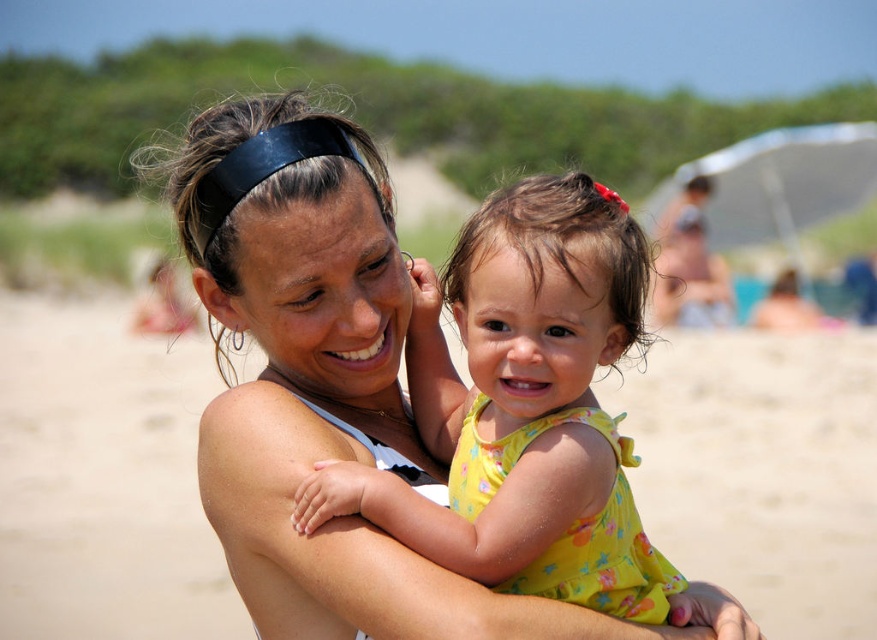
In the scene shown: You are standing at the point labeled point (63,625) and want to see the point labeled point (532,548). Can you see it without moving your position?

Point (63,625) is behind point (532,548), so you cannot see it from your current position.

You are standing at the position of the woman holding the child and want to walk towards the beige sand at center marked by point (103,477). Is there any object between you and the beige sand at center that you might collide with?

There are no objects mentioned between you and the beige sand at center, so you can walk directly towards it without colliding with anything.